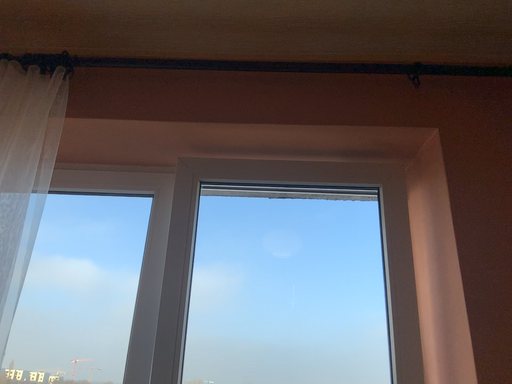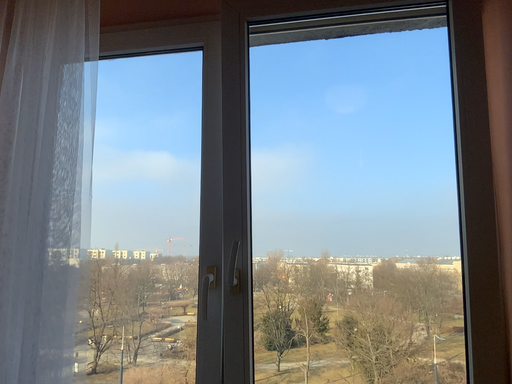
Question: How did the camera likely rotate when shooting the video?

Choices:
 (A) rotated upward
 (B) rotated downward

Answer: (B)